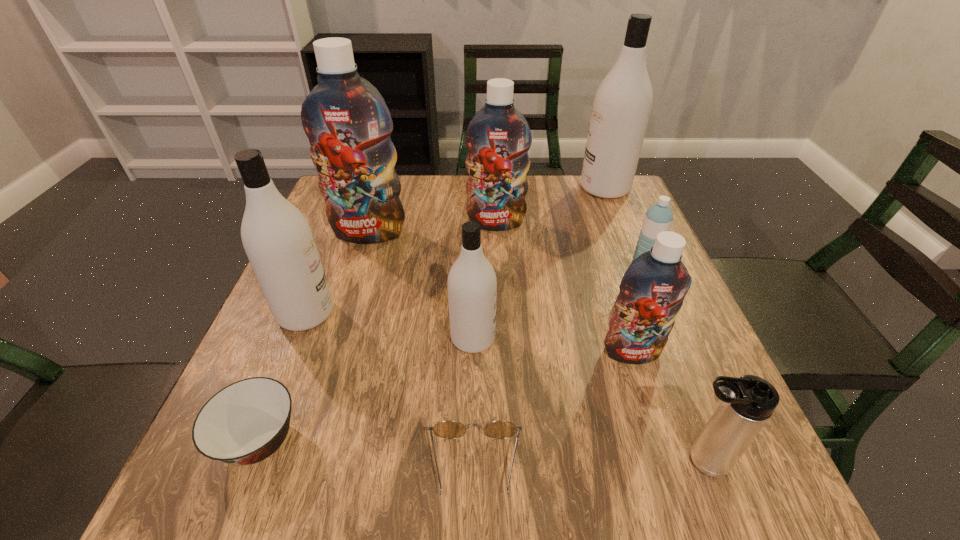
Identify the location of the farthest object. (622, 104).

The image size is (960, 540). I want to click on the biggest white shampoo, so click(622, 104).

The height and width of the screenshot is (540, 960). I want to click on the biggest blue shampoo, so click(x=348, y=124).

Image resolution: width=960 pixels, height=540 pixels. In order to click on the leftmost white shampoo in this screenshot , I will do 277,238.

Where is `the second blue shampoo from right to left`? the second blue shampoo from right to left is located at coordinates (498, 138).

This screenshot has height=540, width=960. Identify the location of the smallest white shampoo. (472, 284).

Image resolution: width=960 pixels, height=540 pixels. Find the location of `the smallest blue shampoo`. the smallest blue shampoo is located at coordinates (652, 290).

You are a GUI agent. You are given a task and a screenshot of the screen. Output one action in this format:
    pyautogui.click(x=<x>, y=<y>)
    Task: Click on the nearest blue shampoo
    
    Given the screenshot: What is the action you would take?
    pyautogui.click(x=652, y=290)

The image size is (960, 540). What are the coordinates of `water bottle` in the screenshot? It's located at (658, 218).

Image resolution: width=960 pixels, height=540 pixels. I want to click on blue water bottle, so click(658, 218).